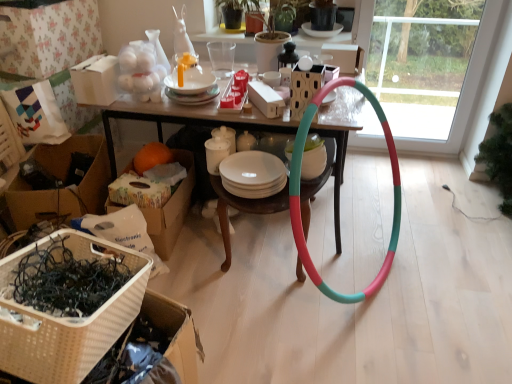
Question: From a real-world perspective, is wooden table at center positioned above or below transparent glass door at center?

Choices:
 (A) below
 (B) above

Answer: (A)

Question: Looking at the image, does wooden table at center seem bigger or smaller compared to transparent glass door at center?

Choices:
 (A) big
 (B) small

Answer: (A)

Question: Which object is the closest to the green matte plant at upper center?

Choices:
 (A) matte white rectangular box at center, marked as the 1th box in a front-to-back arrangement
 (B) cardboard box at lower left, arranged as the first cardboard box when viewed from the right
 (C) wooden table at center
 (D) transparent glass door at center
 (E) orange fuzzy at lower left

Answer: (A)

Question: Estimate the real-world distances between objects in this image. Which object is farther from the white woven basket at lower left?

Choices:
 (A) matte white cardboard box at upper center, arranged as the third box when viewed from the left
 (B) cardboard at left, which is the 1th cardboard box in left-to-right order
 (C) wooden table at center
 (D) orange fuzzy at lower left
 (E) transparent glass door at center

Answer: (E)